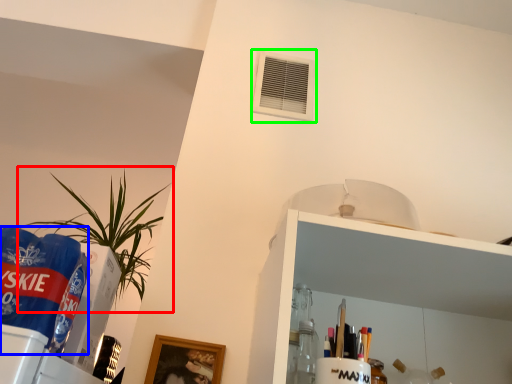
Question: Which object is the closest to the houseplant (highlighted by a red box)? Choose among these: beverage (highlighted by a blue box) or air conditioning (highlighted by a green box).

Choices:
 (A) beverage
 (B) air conditioning

Answer: (B)